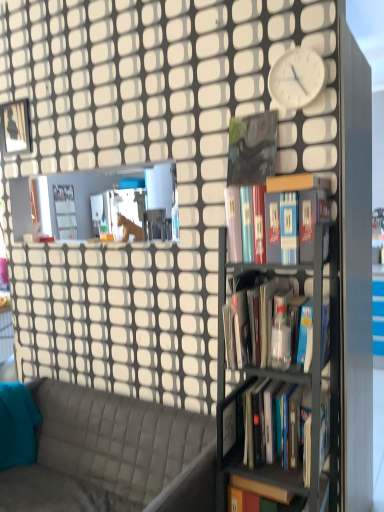
In order to face hardcover book at center, which is counted as the 2th book, starting from the top, should I rotate leftwards or rightwards?

Rotate right and turn 11.280 degrees.

Measure the distance between point (66, 426) and camera.

Point (66, 426) is 6.76 feet from camera.

Describe the element at coordinates (297, 78) in the screenshot. The image size is (384, 512). I see `white matte clock at upper right` at that location.

In order to face metallic gray bookshelf at right, should I rotate leftwards or rightwards?

You should look right and rotate roughly 10.984 degrees.

Locate an element on the screen. This screenshot has width=384, height=512. matte black book at center, the third book when ordered from top to bottom is located at coordinates (266, 323).

This screenshot has width=384, height=512. I want to click on bookshelf that is in front of the hardcover book at center, which is counted as the 2th book, starting from the top, so click(280, 375).

In the scene shown: Considering the sizes of hardcover book at center, which is the 3th book from bottom to top, and metallic gray bookshelf at right in the image, is hardcover book at center, which is the 3th book from bottom to top, wider or thinner than metallic gray bookshelf at right?

hardcover book at center, which is the 3th book from bottom to top, is thinner than metallic gray bookshelf at right.

Does point (268, 203) lie behind point (240, 334)?

No.

Can you confirm if hardcover book at center, which is counted as the 2th book, starting from the top, is taller than metallic gray bookshelf at right?

Incorrect, the height of hardcover book at center, which is counted as the 2th book, starting from the top, is not larger of that of metallic gray bookshelf at right.

You are a GUI agent. You are given a task and a screenshot of the screen. Output one action in this format:
    pyautogui.click(x=<x>, y=<y>)
    Task: Click on the studio couch that appears below the matte black book at center, the third book when ordered from top to bottom (from a real-world perspective)
    
    Given the screenshot: What is the action you would take?
    pyautogui.click(x=112, y=455)

Is point (89, 440) farther from camera compared to point (240, 322)?

Yes, it is behind point (240, 322).

Which object is closer to the camera, gray quilted fabric couch at lower left or matte black book at center, the 2th book from the bottom?

gray quilted fabric couch at lower left is more forward.

Can you confirm if gray quilted fabric couch at lower left is taller than matte black book at center, the 2th book from the bottom?

Correct, gray quilted fabric couch at lower left is much taller as matte black book at center, the 2th book from the bottom.

Considering the points (285, 474) and (47, 510), which point is in front, point (285, 474) or point (47, 510)?

The point (285, 474) is more forward.

Considering the relative sizes of metallic gray bookshelf at right and gray quilted fabric couch at lower left in the image provided, is metallic gray bookshelf at right smaller than gray quilted fabric couch at lower left?

Yes.

Does white matte clock at upper right have a greater width compared to teal fabric pillow at left?

In fact, white matte clock at upper right might be narrower than teal fabric pillow at left.

Is there a large distance between white matte clock at upper right and teal fabric pillow at left?

Yes, white matte clock at upper right is far from teal fabric pillow at left.

Is white matte clock at upper right further to camera compared to teal fabric pillow at left?

No.

Between white matte clock at upper right and teal fabric pillow at left, which one has less height?

With less height is white matte clock at upper right.

Does teal fabric pillow at left appear on the left side of matte black book at center, the 2th book from the bottom?

Indeed, teal fabric pillow at left is positioned on the left side of matte black book at center, the 2th book from the bottom.

Can you confirm if teal fabric pillow at left is bigger than matte black book at center, the 2th book from the bottom?

Actually, teal fabric pillow at left might be smaller than matte black book at center, the 2th book from the bottom.

Is point (0, 384) closer or farther from the camera than point (255, 336)?

Point (0, 384).

Is teal fabric pillow at left not near white matte clock at upper right?

Yes, teal fabric pillow at left and white matte clock at upper right are quite far apart.

Based on the photo, is teal fabric pillow at left facing towards white matte clock at upper right?

No.

Which of these two, teal fabric pillow at left or white matte clock at upper right, is bigger?

Bigger between the two is teal fabric pillow at left.

From the image's perspective, does matte black book at center, the third book when ordered from top to bottom, appear higher than teal fabric pillow at left?

Indeed, from the image's perspective, matte black book at center, the third book when ordered from top to bottom, is shown above teal fabric pillow at left.

Does matte black book at center, the 2th book from the bottom, contain teal fabric pillow at left?

No, teal fabric pillow at left is not inside matte black book at center, the 2th book from the bottom.

Is matte black book at center, the 2th book from the bottom, bigger than teal fabric pillow at left?

Indeed, matte black book at center, the 2th book from the bottom, has a larger size compared to teal fabric pillow at left.

Find the location of a particular element. Image resolution: width=384 pixels, height=512 pixels. bookshelf below the hardcover book at center, which is counted as the 2th book, starting from the top (from the image's perspective) is located at coordinates (280, 375).

This screenshot has width=384, height=512. I want to click on studio couch in front of the matte black book at center, the third book when ordered from top to bottom, so click(112, 455).

Considering their positions, is gray quilted fabric couch at lower left positioned further to hardcover books at center, the 4th book in the top-to-bottom sequence, than white matte clock at upper right?

white matte clock at upper right is further to hardcover books at center, the 4th book in the top-to-bottom sequence.

Considering their positions, is black matte book at center, placed as the 4th book when sorted from bottom to top, positioned closer to metallic gray bookshelf at right than matte black book at center, the 2th book from the bottom?

Based on the image, matte black book at center, the 2th book from the bottom, appears to be nearer to metallic gray bookshelf at right.

Which object lies nearer to the anchor point hardcover book at center, which is the 3th book from bottom to top, teal fabric pillow at left or matte black book at center, the 2th book from the bottom?

Among the two, matte black book at center, the 2th book from the bottom, is located nearer to hardcover book at center, which is the 3th book from bottom to top.

From the image, which object appears to be farther from gray quilted fabric couch at lower left, teal fabric pillow at left or metallic gray bookshelf at right?

metallic gray bookshelf at right is further to gray quilted fabric couch at lower left.

From the picture: Based on their spatial positions, is gray quilted fabric couch at lower left or teal fabric pillow at left further from hardcover books at center, the 4th book in the top-to-bottom sequence?

teal fabric pillow at left lies further to hardcover books at center, the 4th book in the top-to-bottom sequence, than the other object.

From the image, which object appears to be farther from matte black book at center, the 2th book from the bottom, white matte clock at upper right or teal fabric pillow at left?

The object further to matte black book at center, the 2th book from the bottom, is teal fabric pillow at left.

Based on their spatial positions, is hardcover book at center, which is the 3th book from bottom to top, or matte black book at center, the 2th book from the bottom, further from black matte book at center, which appears as the 1th book when viewed from the top?

The object further to black matte book at center, which appears as the 1th book when viewed from the top, is matte black book at center, the 2th book from the bottom.

Estimate the real-world distances between objects in this image. Which object is closer to black matte book at center, which appears as the 1th book when viewed from the top, teal fabric pillow at left or metallic gray bookshelf at right?

metallic gray bookshelf at right is positioned closer to the anchor black matte book at center, which appears as the 1th book when viewed from the top.

Identify the location of bookshelf between gray quilted fabric couch at lower left and hardcover books at center, the 4th book in the top-to-bottom sequence, in the horizontal direction. The image size is (384, 512). (280, 375).

In order to click on studio couch located between teal fabric pillow at left and hardcover book at center, which is counted as the 2th book, starting from the top, in the left-right direction in this screenshot , I will do `click(112, 455)`.

Locate an element on the screen. book that lies between black matte book at center, which appears as the 1th book when viewed from the top, and matte black book at center, the 2th book from the bottom, from top to bottom is located at coordinates (296, 216).

You are a GUI agent. You are given a task and a screenshot of the screen. Output one action in this format:
    pyautogui.click(x=<x>, y=<y>)
    Task: Click on the book between hardcover book at center, which is the 3th book from bottom to top, and metallic gray bookshelf at right, in the vertical direction
    
    Given the screenshot: What is the action you would take?
    pyautogui.click(x=266, y=323)